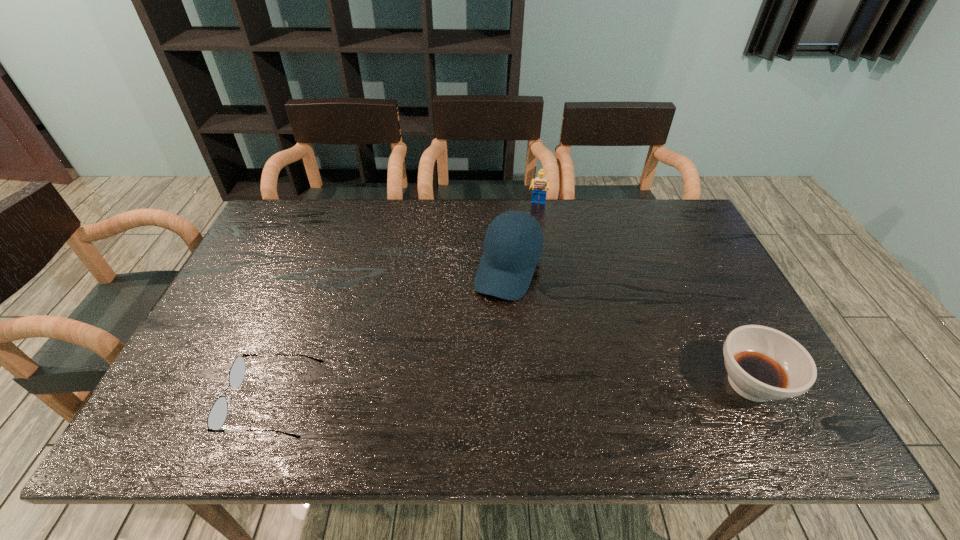
I want to click on free space on the desktop that is between the shortest object and the second shortest object and is positioned on the front-facing side of the baseball cap, so click(453, 394).

Where is `vacant spot on the desktop that is between the leftmost object and the third tallest object and is positioned on the face of the Lego`? The height and width of the screenshot is (540, 960). vacant spot on the desktop that is between the leftmost object and the third tallest object and is positioned on the face of the Lego is located at coordinates (508, 393).